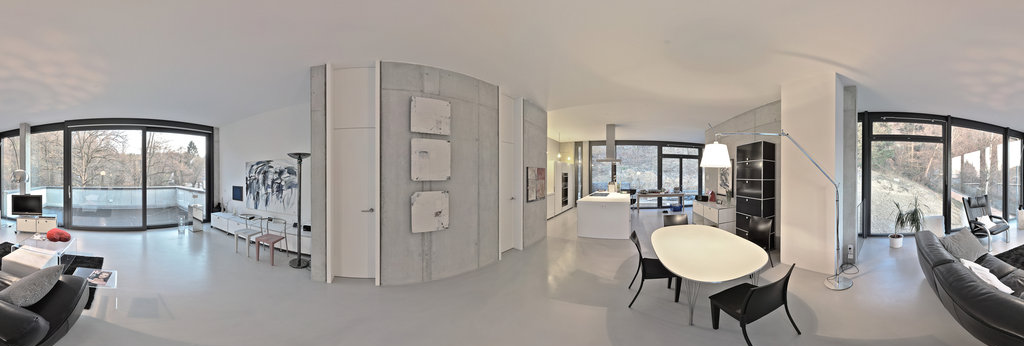
At what (x,y) coordinates should I click in order to perform the action: click on couch. Please return your answer as a coordinate pair (x, y). Looking at the image, I should click on (46, 296).